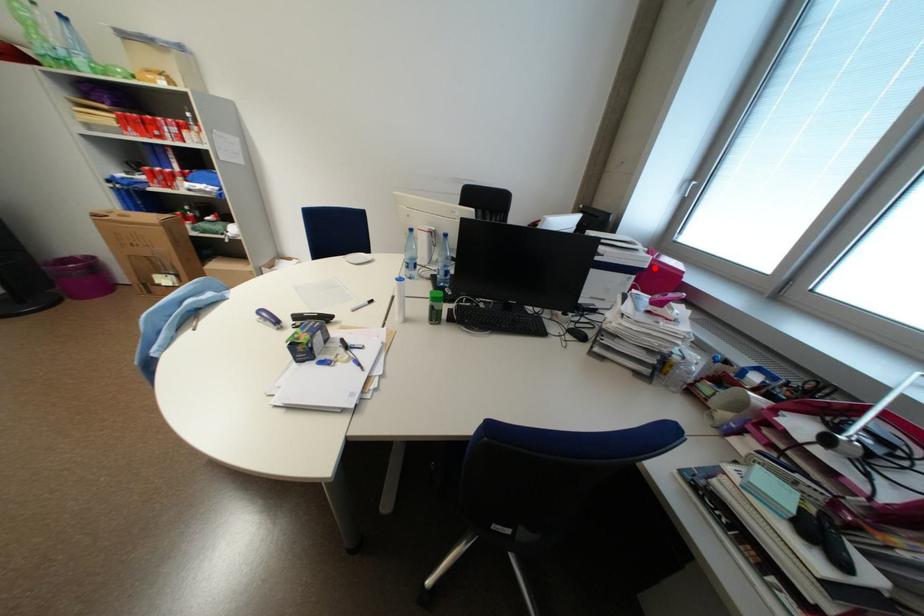
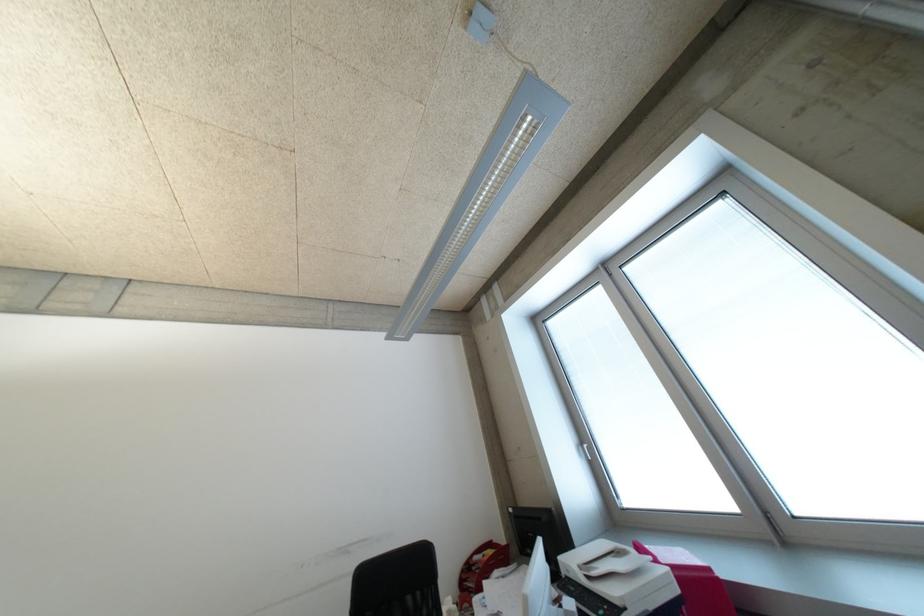
Find the pixel in the second image that matches the highlighted location in the first image.

(687, 591)